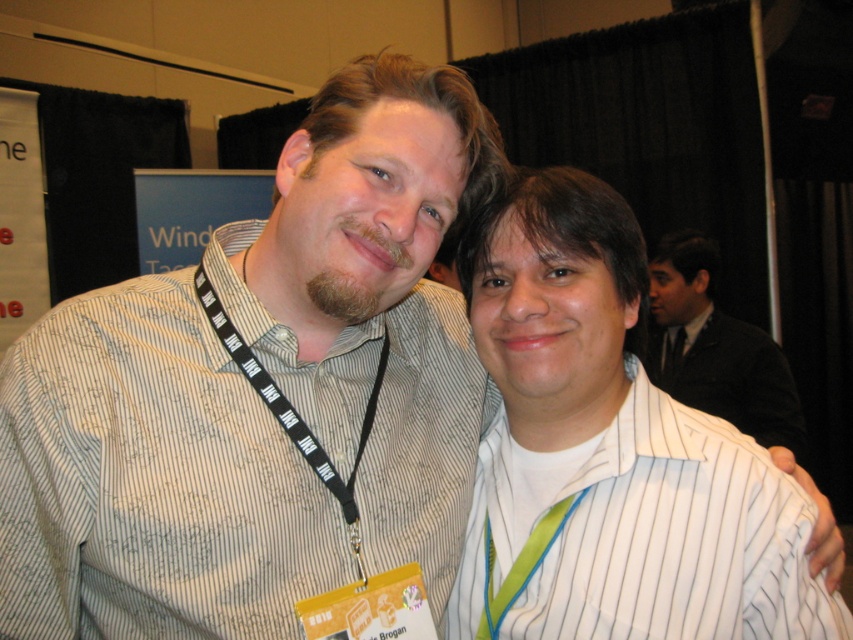
Question: Does striped cotton shirt at center have a greater width compared to black fabric lanyard at left?

Choices:
 (A) no
 (B) yes

Answer: (B)

Question: Among these objects, which one is nearest to the camera?

Choices:
 (A) black fabric lanyard at left
 (B) black suit jacket at upper right
 (C) white striped shirt at center

Answer: (A)

Question: Is black suit jacket at upper right to the right of black fabric lanyard at left from the viewer's perspective?

Choices:
 (A) yes
 (B) no

Answer: (A)

Question: Estimate the real-world distances between objects in this image. Which object is closer to the black fabric lanyard at left?

Choices:
 (A) black suit jacket at upper right
 (B) white striped shirt at center

Answer: (B)

Question: Does white striped shirt at center have a lesser width compared to black suit jacket at upper right?

Choices:
 (A) yes
 (B) no

Answer: (B)

Question: Which object appears farthest from the camera in this image?

Choices:
 (A) white striped shirt at center
 (B) black suit jacket at upper right
 (C) black fabric lanyard at left
 (D) striped cotton shirt at center

Answer: (B)